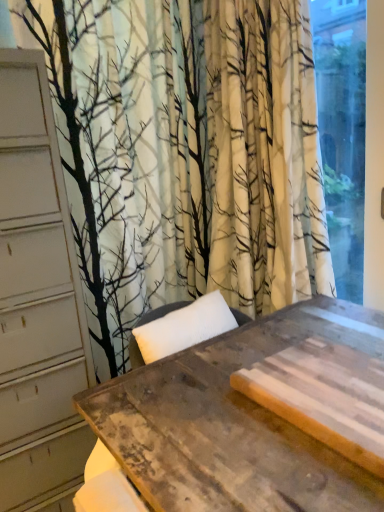
Question: Does transparent glass window at right have a lesser width compared to rustic wood table at center?

Choices:
 (A) yes
 (B) no

Answer: (A)

Question: Considering the relative sizes of transparent glass window at right and rustic wood table at center in the image provided, is transparent glass window at right shorter than rustic wood table at center?

Choices:
 (A) no
 (B) yes

Answer: (A)

Question: Can you confirm if transparent glass window at right is positioned to the left of rustic wood table at center?

Choices:
 (A) no
 (B) yes

Answer: (A)

Question: Can rustic wood table at center be found inside transparent glass window at right?

Choices:
 (A) no
 (B) yes

Answer: (A)

Question: Can we say transparent glass window at right lies outside rustic wood table at center?

Choices:
 (A) no
 (B) yes

Answer: (B)

Question: Can you confirm if transparent glass window at right is smaller than rustic wood table at center?

Choices:
 (A) yes
 (B) no

Answer: (A)

Question: From the image's perspective, does rustic wood table at center appear higher than transparent glass window at right?

Choices:
 (A) yes
 (B) no

Answer: (B)

Question: Can you confirm if rustic wood table at center is positioned to the left of transparent glass window at right?

Choices:
 (A) yes
 (B) no

Answer: (A)

Question: From a real-world perspective, does rustic wood table at center stand above transparent glass window at right?

Choices:
 (A) no
 (B) yes

Answer: (A)

Question: Could you tell me if rustic wood table at center is facing transparent glass window at right?

Choices:
 (A) yes
 (B) no

Answer: (B)

Question: Is rustic wood table at center not close to transparent glass window at right?

Choices:
 (A) yes
 (B) no

Answer: (B)

Question: Can you confirm if rustic wood table at center is bigger than transparent glass window at right?

Choices:
 (A) yes
 (B) no

Answer: (A)

Question: In terms of size, does rustic wood table at center appear bigger or smaller than transparent glass window at right?

Choices:
 (A) small
 (B) big

Answer: (B)